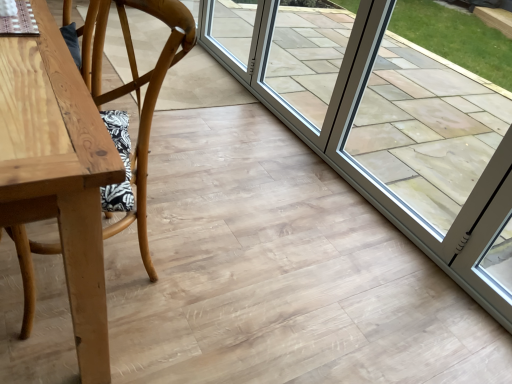
Question: From the image's perspective, is clear glass door at center above wooden chair at left?

Choices:
 (A) no
 (B) yes

Answer: (B)

Question: Is clear glass door at center smaller than wooden chair at left?

Choices:
 (A) yes
 (B) no

Answer: (A)

Question: Is clear glass door at center directly adjacent to wooden chair at left?

Choices:
 (A) no
 (B) yes

Answer: (A)

Question: Could you tell me if clear glass door at center is facing wooden chair at left?

Choices:
 (A) no
 (B) yes

Answer: (B)

Question: Is clear glass door at center shorter than wooden chair at left?

Choices:
 (A) no
 (B) yes

Answer: (B)

Question: Is clear glass door at center thinner than wooden chair at left?

Choices:
 (A) yes
 (B) no

Answer: (A)

Question: Considering the relative positions of clear glass door at center and transparent glass door at right in the image provided, is clear glass door at center in front of transparent glass door at right?

Choices:
 (A) no
 (B) yes

Answer: (A)

Question: Can you confirm if clear glass door at center is positioned to the right of transparent glass door at right?

Choices:
 (A) no
 (B) yes

Answer: (A)

Question: Is clear glass door at center in contact with transparent glass door at right?

Choices:
 (A) no
 (B) yes

Answer: (A)

Question: Would you say clear glass door at center contains transparent glass door at right?

Choices:
 (A) yes
 (B) no

Answer: (B)

Question: From a real-world perspective, is clear glass door at center physically above transparent glass door at right?

Choices:
 (A) no
 (B) yes

Answer: (A)

Question: Can you confirm if clear glass door at center is bigger than transparent glass door at right?

Choices:
 (A) yes
 (B) no

Answer: (B)

Question: Is the depth of transparent glass door at right less than that of wooden chair at left?

Choices:
 (A) yes
 (B) no

Answer: (B)